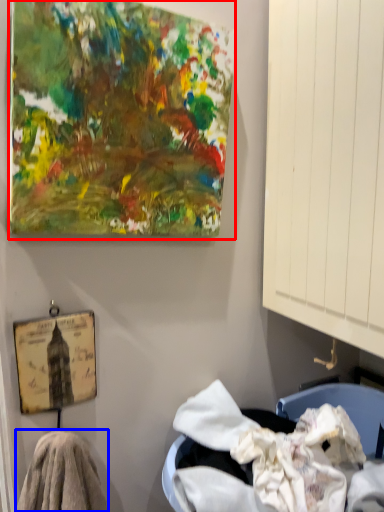
Question: Which object is further to the camera taking this photo, oil painting (highlighted by a red box) or material (highlighted by a blue box)?

Choices:
 (A) oil painting
 (B) material

Answer: (B)